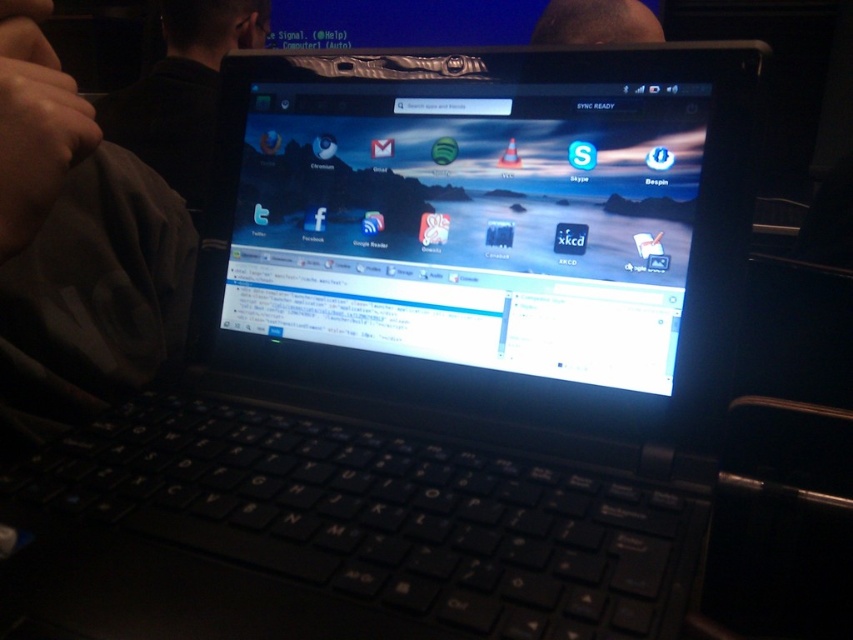
You are a graphic designer working on a project and need to place a sticker on the laptop screen. You have two points to choose from on the screen. Which point is closer to the viewer? The points are point (647, 250) and point (27, 140).

Point (647, 250) is further to the viewer than point (27, 140), so the closer point to the viewer is point (27, 140).

From the picture: You are trying to clean the laptop screen. You have a microfiber cloth in your hand. The dark fabric at lower left is a part of the laptop. Should you use the cloth to clean the glossy plastic screen at center?

The glossy plastic screen at center is positioned on the right side of dark fabric at lower left. Since the dark fabric at lower left is part of the laptop, it is likely the screen is the display area. Use the cloth to clean the glossy plastic screen at center as it is the screen surface.